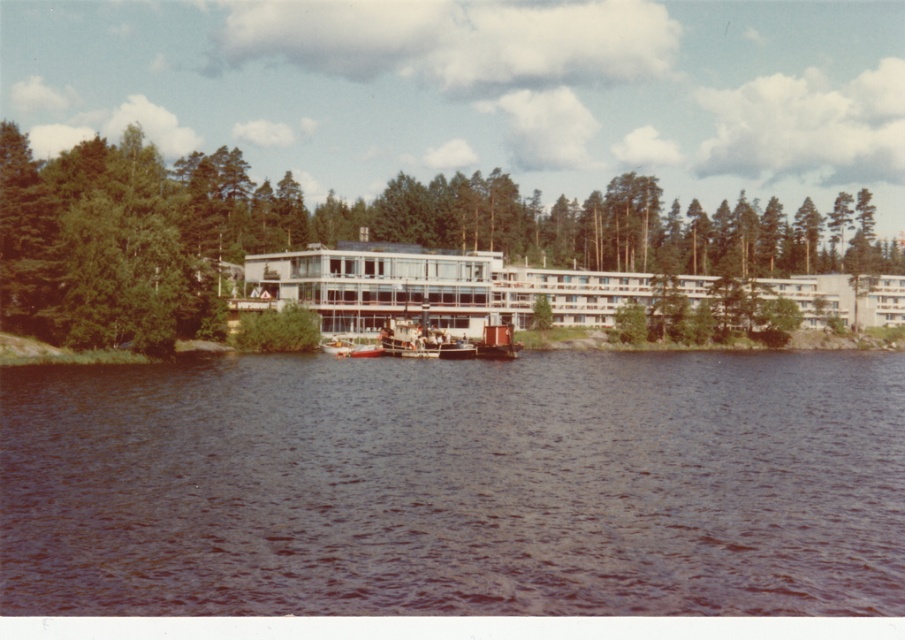
You are standing at the lakeside and want to take a photo of the brown water at center and the green leafy tree at center. Which object will appear larger in your photo?

The brown water at center will appear larger in the photo because it is closer to the viewer than the green leafy tree at center.

You are standing on the dock and want to board the wooden boat at center. Which direction should you walk relative to the matte glass building at center?

You should walk to the left of the matte glass building at center because the wooden boat at center is positioned on the left side of the matte glass building at center.